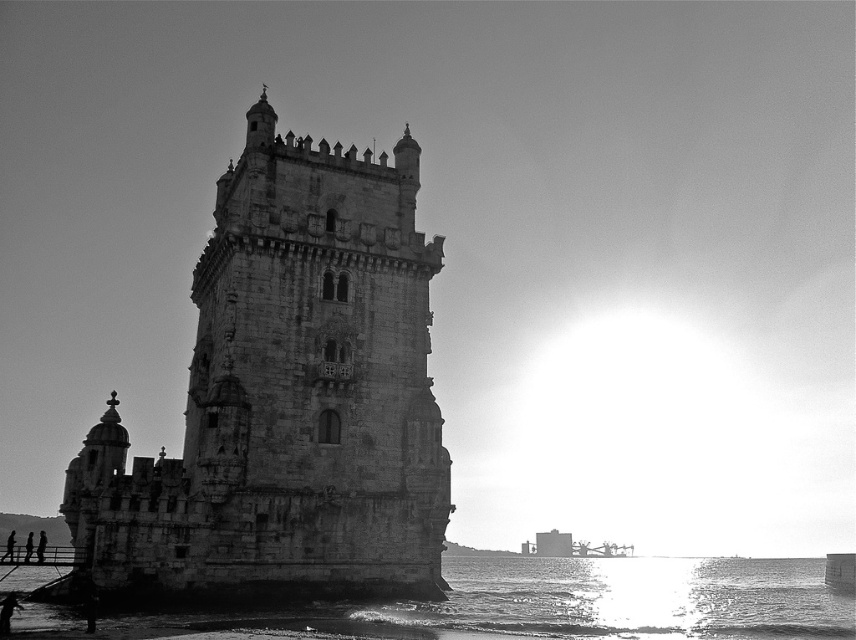
Who is higher up, stone tower at center or reflective silver water at lower center?

stone tower at center is above.

Is stone tower at center behind reflective silver water at lower center?

Yes, stone tower at center is behind reflective silver water at lower center.

The height and width of the screenshot is (640, 856). What do you see at coordinates (288, 396) in the screenshot? I see `stone tower at center` at bounding box center [288, 396].

Image resolution: width=856 pixels, height=640 pixels. Find the location of `stone tower at center`. stone tower at center is located at coordinates (288, 396).